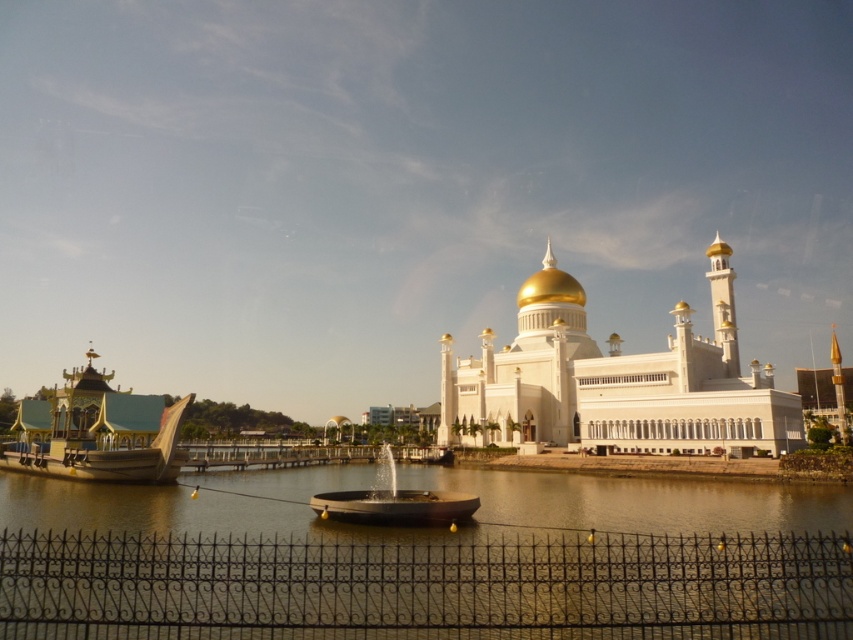
You are a tourist standing in front of the black wrought iron fence at lower center and the white glossy mosque at center. Which object appears larger in the image?

The white glossy mosque at center appears larger than the black wrought iron fence at lower center.

You are a tourist standing in front of the black wrought iron fence at lower center and want to take a photo of the gold polished wood boat at left. Since the fence is between you and the boat, will the boat be fully visible in your photo?

The black wrought iron fence at lower center is closer to the viewer than the gold polished wood boat at left, so the boat will be partially obscured by the fence in the photo.

You are a visitor standing in front of the black wrought iron fence at lower center and want to take a photo of the white glossy mosque at center. Since the fence is between you and the mosque, will the fence appear in your photo?

The black wrought iron fence at lower center is located below the white glossy mosque at center, so the fence will not block the view of the mosque in the photo.